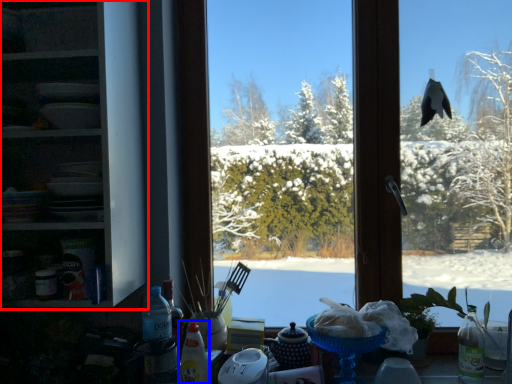
Question: Which point is further to the camera, shelf (highlighted by a red box) or bottle (highlighted by a blue box)?

Choices:
 (A) shelf
 (B) bottle

Answer: (B)